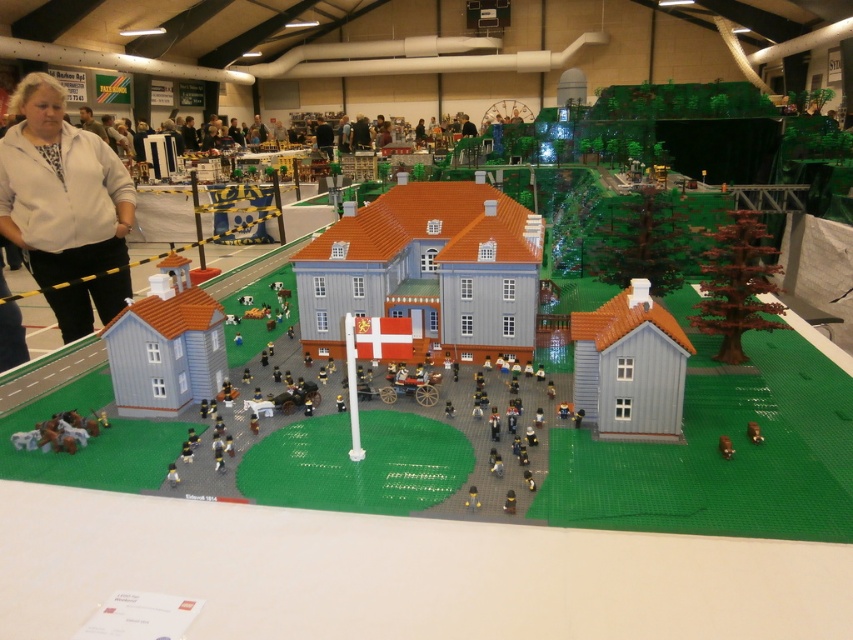
Does point (573, 317) lie in front of point (751, 422)?

No, (573, 317) is behind (751, 422).

Does matte gray house at lower right have a smaller size compared to metallic gold key at center?

No, matte gray house at lower right is not smaller than metallic gold key at center.

Locate an element on the screen. This screenshot has height=640, width=853. matte gray house at lower right is located at coordinates (630, 365).

Where is `matte gray house at lower right`? The height and width of the screenshot is (640, 853). matte gray house at lower right is located at coordinates (630, 365).

Which is in front, point (518, 296) or point (659, 413)?

Point (659, 413) is more forward.

Identify the location of smooth gray house at center. (427, 272).

How far apart are smooth gray house at center and metallic gold key at center?

smooth gray house at center is 1.12 meters away from metallic gold key at center.

Is smooth gray house at center closer to the viewer compared to metallic gold key at center?

No.

The height and width of the screenshot is (640, 853). What do you see at coordinates (427, 272) in the screenshot? I see `smooth gray house at center` at bounding box center [427, 272].

Locate an element on the screen. smooth gray house at center is located at coordinates (427, 272).